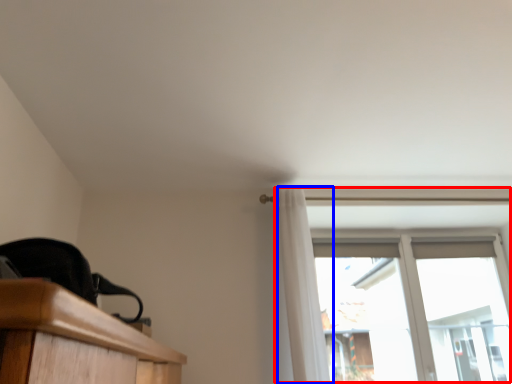
Question: Among these objects, which one is nearest to the camera, window (highlighted by a red box) or curtain (highlighted by a blue box)?

Choices:
 (A) window
 (B) curtain

Answer: (B)